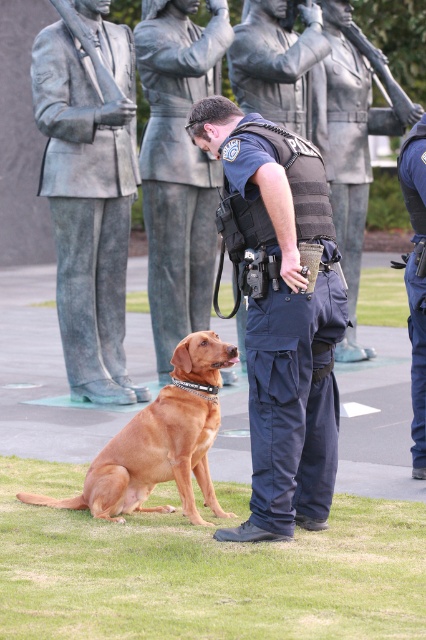
Can you confirm if blue uniform at center is wider than bronze statue at center?

In fact, blue uniform at center might be narrower than bronze statue at center.

Which is behind, point (296, 500) or point (336, 216)?

The point (336, 216) is behind.

I want to click on blue uniform at center, so pyautogui.click(x=281, y=314).

From the picture: Is blue uniform at center to the left of bronze statue of man at left from the viewer's perspective?

No, blue uniform at center is not to the left of bronze statue of man at left.

Which is below, blue uniform at center or bronze statue of man at left?

blue uniform at center is lower down.

What do you see at coordinates (281, 314) in the screenshot? I see `blue uniform at center` at bounding box center [281, 314].

The width and height of the screenshot is (426, 640). I want to click on blue uniform at center, so (281, 314).

Which of these two, blue uniform at center or brushed metal statue at center, stands taller?

With more height is brushed metal statue at center.

Is blue uniform at center below brushed metal statue at center?

Indeed, blue uniform at center is positioned under brushed metal statue at center.

Where is `blue uniform at center`? The width and height of the screenshot is (426, 640). blue uniform at center is located at coordinates (281, 314).

Locate an element on the screen. This screenshot has height=640, width=426. blue uniform at center is located at coordinates (281, 314).